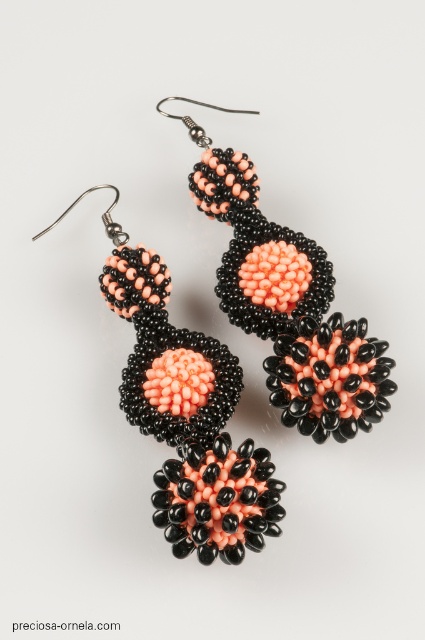
Between coral matte/black beaded earrings at center and matte coral beads at center, which one has more height?

coral matte/black beaded earrings at center is taller.

Between coral matte/black beaded earrings at center and matte coral beads at center, which one appears on the right side from the viewer's perspective?

Positioned to the right is matte coral beads at center.

Is point (240, 467) positioned behind point (218, 160)?

No.

The height and width of the screenshot is (640, 425). I want to click on coral matte/black beaded earrings at center, so click(187, 413).